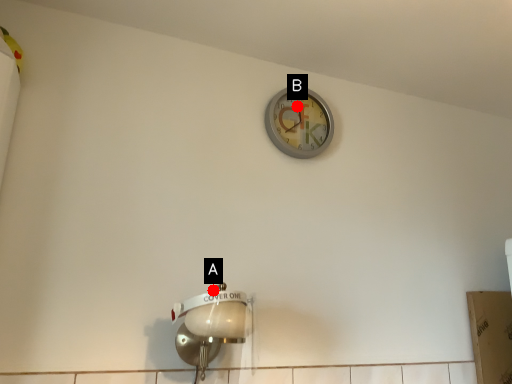
Question: Two points are circled on the image, labeled by A and B beside each circle. Which point is closer to the camera?

Choices:
 (A) A is closer
 (B) B is closer

Answer: (A)